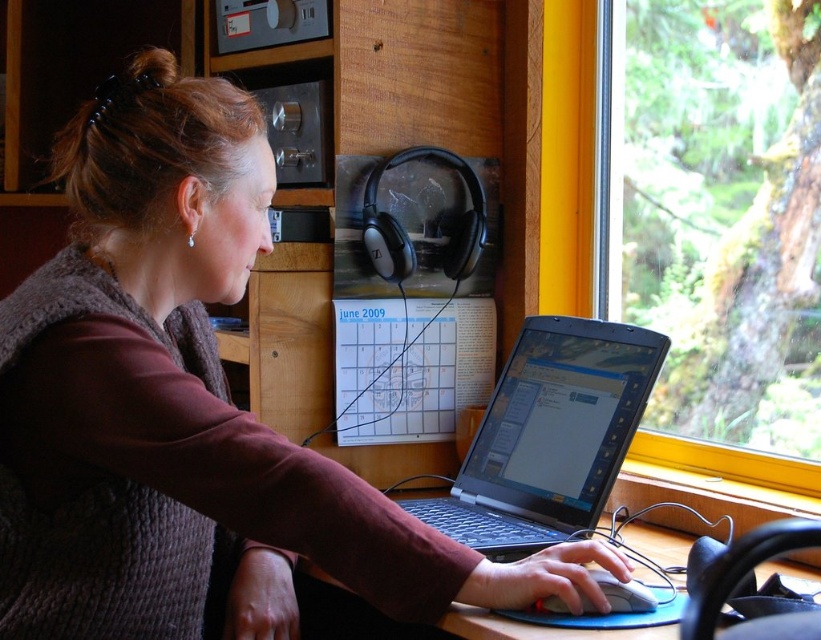
Question: Can you confirm if matte brown sweater at center is positioned to the right of white plastic mouse at lower center?

Choices:
 (A) no
 (B) yes

Answer: (A)

Question: Which point appears closest to the camera in this image?

Choices:
 (A) (586, 394)
 (B) (102, 492)
 (C) (645, 602)
 (D) (758, 129)

Answer: (B)

Question: Which point is closer to the camera?

Choices:
 (A) pos(654,326)
 (B) pos(540,323)
 (C) pos(148,612)
 (D) pos(618,589)

Answer: (C)

Question: Does transparent glass window at upper right have a lesser width compared to white plastic mouse at lower center?

Choices:
 (A) no
 (B) yes

Answer: (A)

Question: Is matte brown sweater at center thinner than transparent glass window at upper right?

Choices:
 (A) no
 (B) yes

Answer: (A)

Question: Which of these objects is positioned closest to the black plastic laptop at center?

Choices:
 (A) transparent glass window at upper right
 (B) matte brown sweater at center
 (C) white plastic mouse at lower center

Answer: (C)